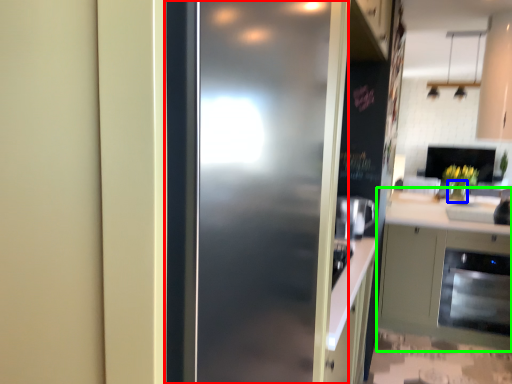
Question: Which object is positioned farthest from door (highlighted by a red box)? Select from vase (highlighted by a blue box) and cabinetry (highlighted by a green box).

Choices:
 (A) vase
 (B) cabinetry

Answer: (A)